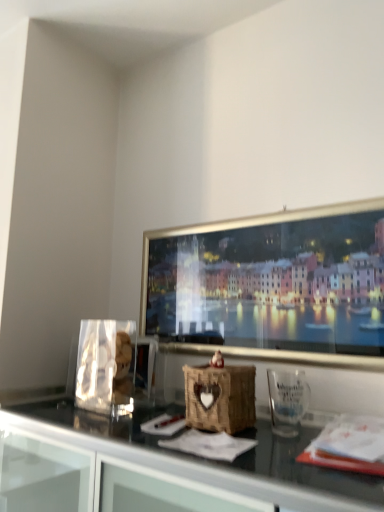
Question: From a real-world perspective, relative to woven wood basket at center, is transparent plastic glass at lower right vertically above or below?

Choices:
 (A) above
 (B) below

Answer: (A)

Question: Based on their sizes in the image, would you say transparent plastic glass at lower right is bigger or smaller than woven wood basket at center?

Choices:
 (A) small
 (B) big

Answer: (A)

Question: Do you think transparent plastic glass at lower right is within woven wood basket at center, or outside of it?

Choices:
 (A) inside
 (B) outside

Answer: (B)

Question: Relative to transparent plastic glass at lower right, is woven wood basket at center in front or behind?

Choices:
 (A) behind
 (B) front

Answer: (A)

Question: Considering the positions of woven wood basket at center and transparent plastic glass at lower right in the image, is woven wood basket at center wider or thinner than transparent plastic glass at lower right?

Choices:
 (A) thin
 (B) wide

Answer: (B)

Question: Is woven wood basket at center inside or outside of transparent plastic glass at lower right?

Choices:
 (A) outside
 (B) inside

Answer: (A)

Question: In terms of height, does woven wood basket at center look taller or shorter compared to transparent plastic glass at lower right?

Choices:
 (A) tall
 (B) short

Answer: (A)